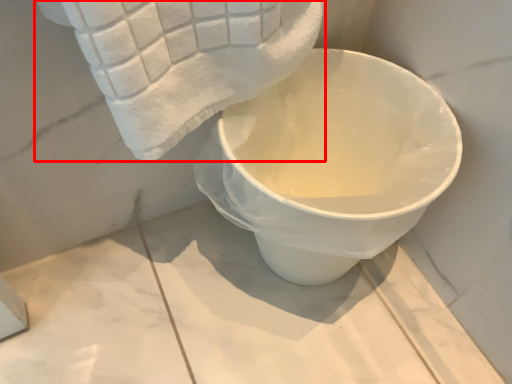
Question: From the image's perspective, what is the correct spatial relationship of towel (annotated by the red box) in relation to toilet?

Choices:
 (A) below
 (B) above

Answer: (B)